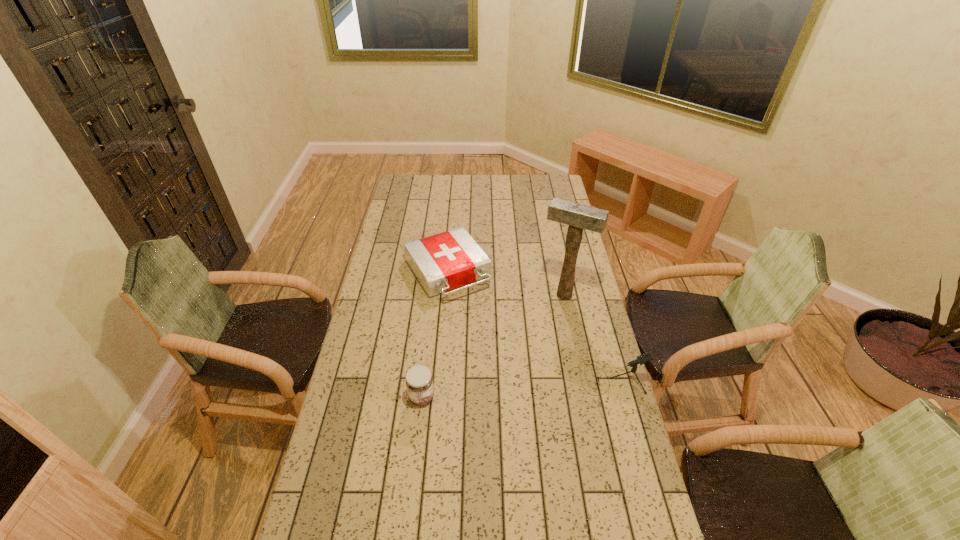
This screenshot has height=540, width=960. I want to click on vacant region between the tallest object and the shortest object, so click(x=505, y=284).

You are a GUI agent. You are given a task and a screenshot of the screen. Output one action in this format:
    pyautogui.click(x=<x>, y=<y>)
    Task: Click on the free spot between the microphone and the shortest object
    The image size is (960, 540).
    Given the screenshot: What is the action you would take?
    pyautogui.click(x=530, y=325)

You are a GUI agent. You are given a task and a screenshot of the screen. Output one action in this format:
    pyautogui.click(x=<x>, y=<y>)
    Task: Click on the free spot between the shortest object and the mallet
    The width and height of the screenshot is (960, 540).
    Given the screenshot: What is the action you would take?
    pyautogui.click(x=505, y=284)

What are the coordinates of `object that can be found as the second closest to the first-aid kit` in the screenshot? It's located at click(x=419, y=381).

Select which object is the third closest to the microphone. Please provide its 2D coordinates. Your answer should be formatted as a tuple, i.e. [(x, y)], where the tuple contains the x and y coordinates of a point satisfying the conditions above.

[(419, 381)]